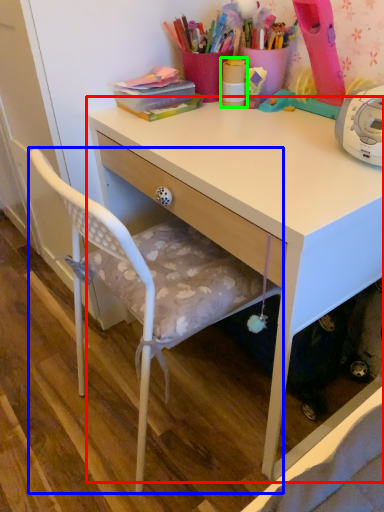
Question: Which object is the farthest from desk (highlighted by a red box)? Choose among these: chair (highlighted by a blue box) or office supplies (highlighted by a green box).

Choices:
 (A) chair
 (B) office supplies

Answer: (B)